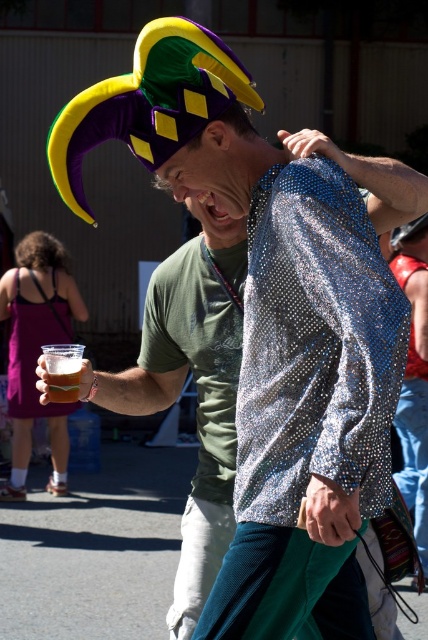
You are a photographer trying to capture a clear shot of the brown hair at upper left and the matte black hat at upper center. Which object should you focus on first to ensure it appears sharp in the photo?

The brown hair at upper left should be focused on first because it is taller than the matte black hat at upper center, making it more prominent in the frame.

You are standing in the middle of the lively outdoor scene. There are two points marked in the image. The first point is at coordinates point (33, 236) and the second point is at point (422, 225). Which point is closer to you?

Point (33, 236) is closer to you because it is further to the viewer than point (422, 225).

You are a photographer trying to capture a clear shot of the shiny metallic hat at upper center and the brown hair at upper left. Which object is blocking the view of the other?

The shiny metallic hat at upper center is behind brown hair at upper left, so the brown hair at upper left is blocking the view of the shiny metallic hat at upper center.